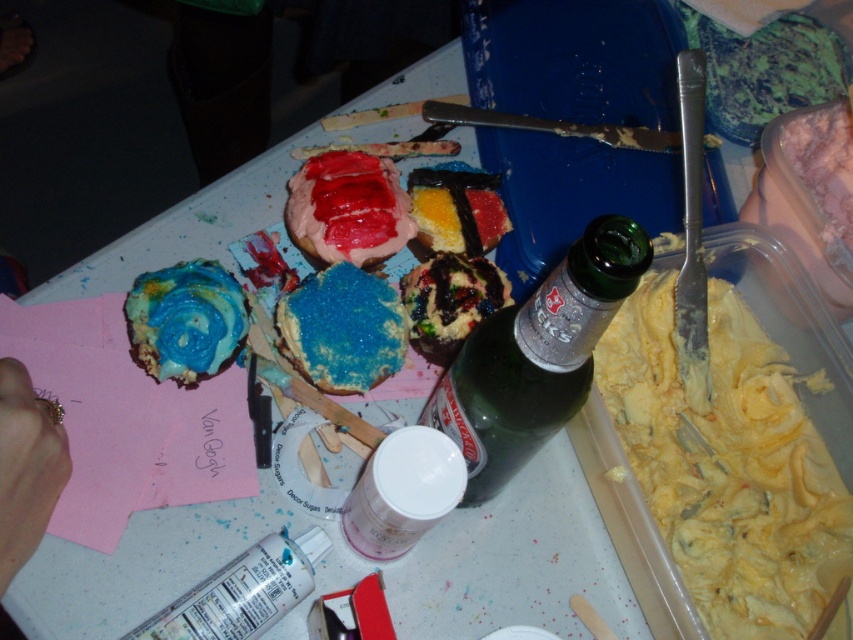
This screenshot has height=640, width=853. Describe the element at coordinates (728, 465) in the screenshot. I see `yellow creamy frosting at center right` at that location.

Which is below, yellow creamy frosting at center right or green glass bottle at center?

yellow creamy frosting at center right is lower down.

Who is more distant from viewer, (776, 477) or (601, 310)?

Positioned behind is point (776, 477).

This screenshot has height=640, width=853. I want to click on yellow creamy frosting at center right, so click(x=728, y=465).

Is yellow creamy frosting at center right shorter than gold ring at lower left?

No.

Is yellow creamy frosting at center right to the right of gold ring at lower left from the viewer's perspective?

Yes, yellow creamy frosting at center right is to the right of gold ring at lower left.

Does point (769, 355) lie behind point (15, 456)?

Yes, point (769, 355) is farther from viewer.

Find the location of a particular element. yellow creamy frosting at center right is located at coordinates (728, 465).

Consider the image. Which is more to the left, yellow creamy frosting at center right or blue frosted pastry at center-left?

blue frosted pastry at center-left is more to the left.

Locate an element on the screen. This screenshot has width=853, height=640. yellow creamy frosting at center right is located at coordinates (728, 465).

You are a GUI agent. You are given a task and a screenshot of the screen. Output one action in this format:
    pyautogui.click(x=<x>, y=<y>)
    Task: Click on the yellow creamy frosting at center right
    This screenshot has width=853, height=640.
    Given the screenshot: What is the action you would take?
    pyautogui.click(x=728, y=465)